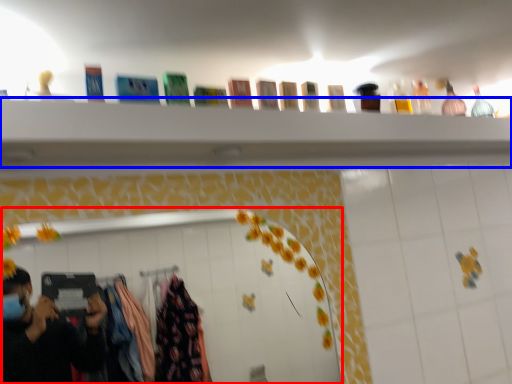
Question: Which of the following is the farthest to the observer, mirror (highlighted by a red box) or closet (highlighted by a blue box)?

Choices:
 (A) mirror
 (B) closet

Answer: (A)